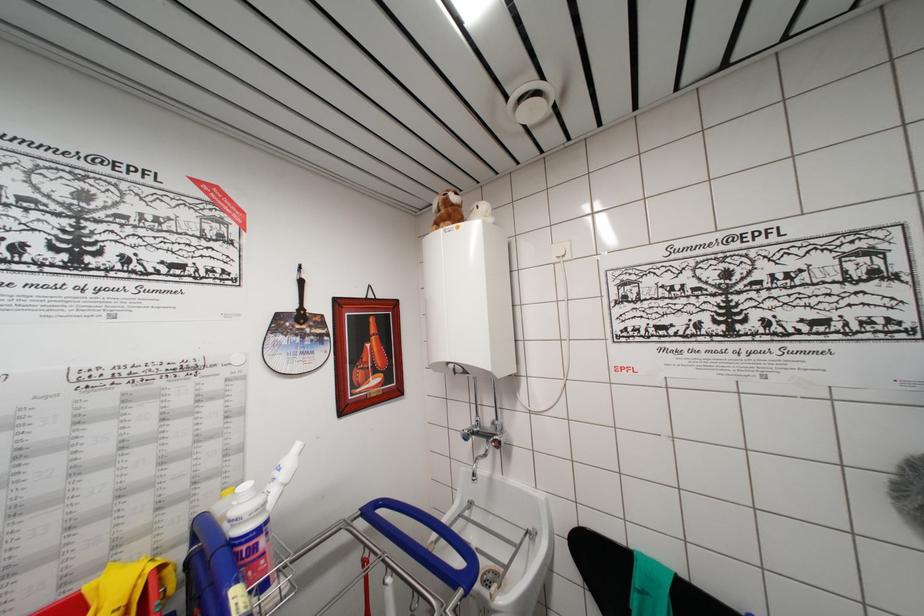
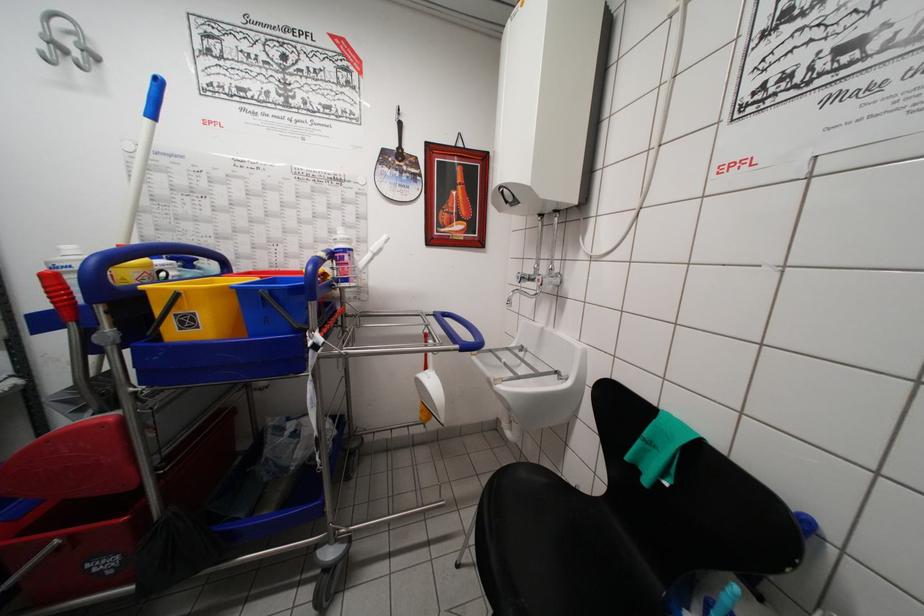
In the second image, find the point that corresponds to the point at 468,440 in the first image.

(521, 282)